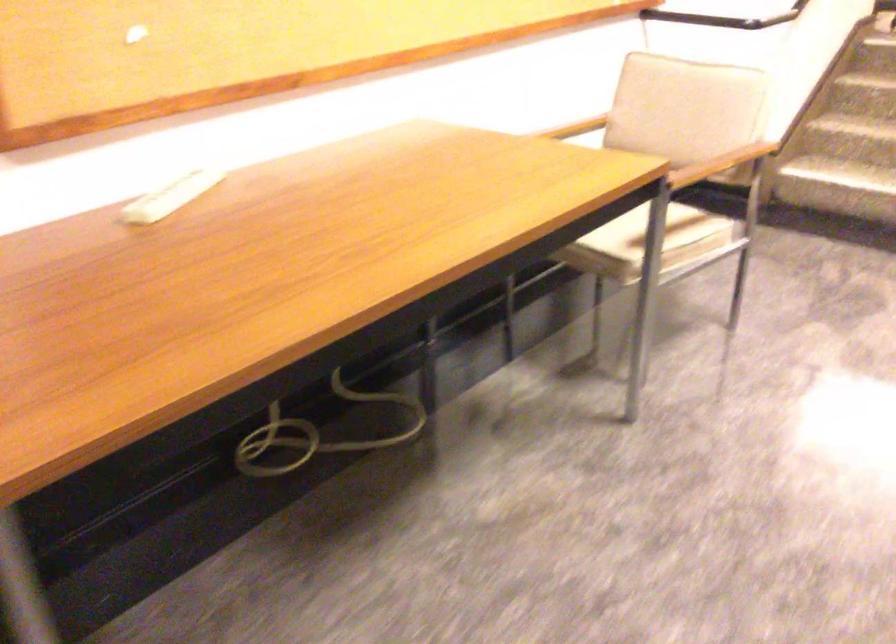
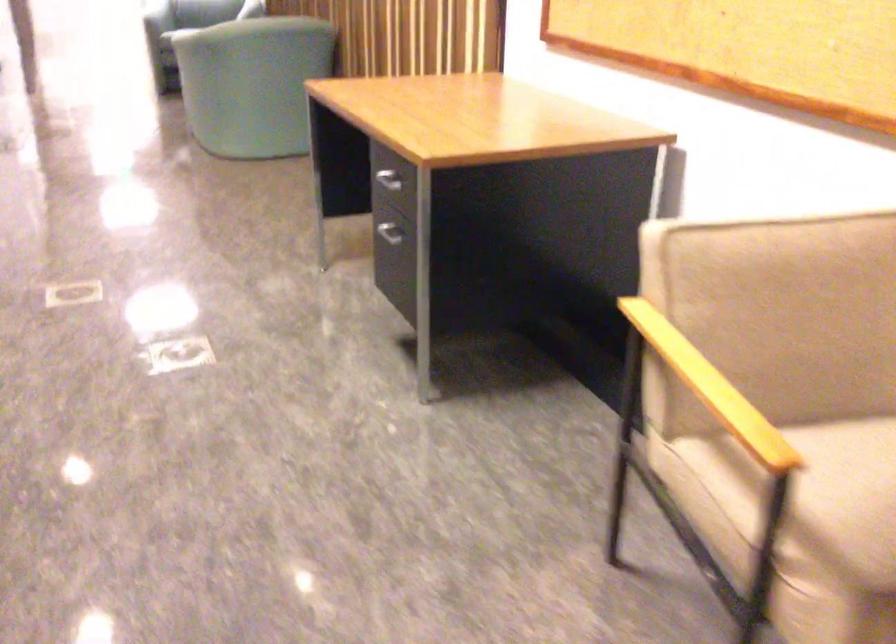
The images are taken continuously from a first-person perspective. In which direction is your viewpoint rotating?

The camera's rotation is toward left-down.